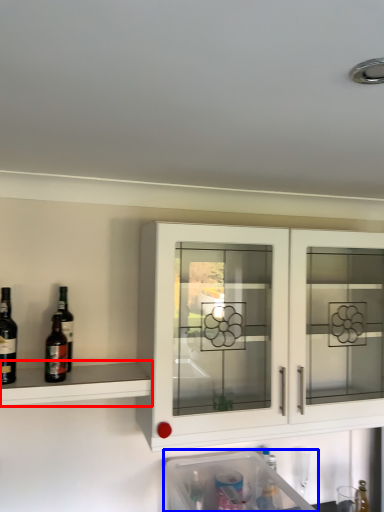
Question: Which object appears farthest to the camera in this image, shelf (highlighted by a red box) or dish washer (highlighted by a blue box)?

Choices:
 (A) shelf
 (B) dish washer

Answer: (A)